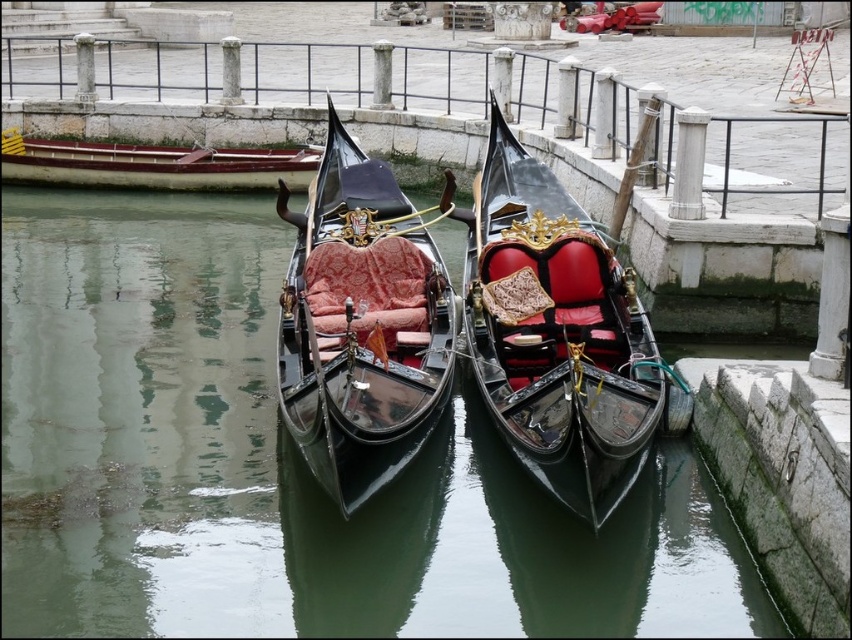
Is glossy black water at center shorter than wooden polished boat at left?

No, glossy black water at center is not shorter than wooden polished boat at left.

This screenshot has width=852, height=640. Find the location of `glossy black water at center`. glossy black water at center is located at coordinates (285, 467).

Identify the location of glossy black water at center. The height and width of the screenshot is (640, 852). (285, 467).

Based on the photo, between glossy black water at center and brushed metal rail at upper center, which one is positioned lower?

Positioned lower is glossy black water at center.

This screenshot has width=852, height=640. In order to click on glossy black water at center in this screenshot , I will do `click(285, 467)`.

What are the coordinates of `glossy black water at center` in the screenshot? It's located at (285, 467).

Is polished wood gondola at center positioned behind wooden polished boat at left?

No, it is not.

Does polished wood gondola at center appear on the left side of wooden polished boat at left?

Incorrect, polished wood gondola at center is not on the left side of wooden polished boat at left.

Who is more forward, (406, 282) or (209, 163)?

Point (406, 282) is in front.

Identify the location of polished wood gondola at center. (361, 324).